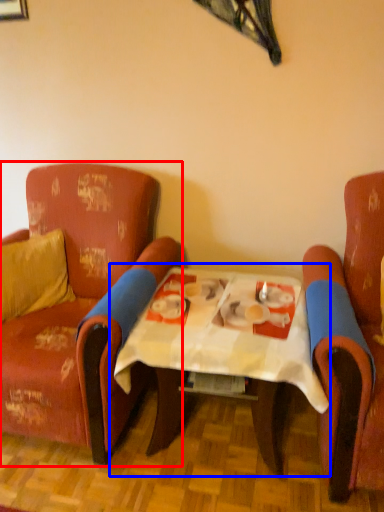
Question: Which object appears closest to the camera in this image, chair (highlighted by a red box) or table (highlighted by a blue box)?

Choices:
 (A) chair
 (B) table

Answer: (B)